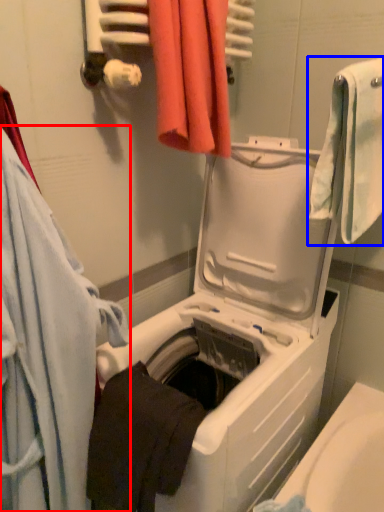
Question: Among these objects, which one is nearest to the camera, towel (highlighted by a red box) or towel (highlighted by a blue box)?

Choices:
 (A) towel
 (B) towel

Answer: (A)